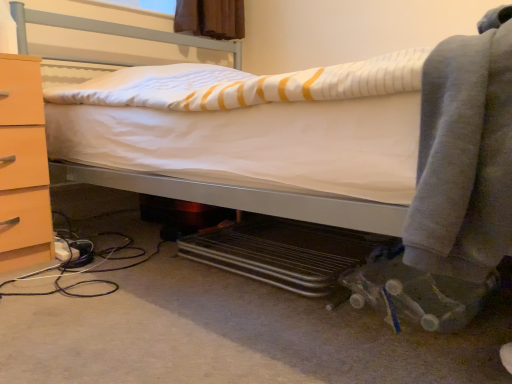
Question: From the image's perspective, does matte wood chest of drawers at left appear lower than gray fleece blanket at lower right?

Choices:
 (A) no
 (B) yes

Answer: (B)

Question: Is matte wood chest of drawers at left not inside gray fleece blanket at lower right?

Choices:
 (A) no
 (B) yes

Answer: (B)

Question: Is matte wood chest of drawers at left closer to camera compared to gray fleece blanket at lower right?

Choices:
 (A) no
 (B) yes

Answer: (A)

Question: From a real-world perspective, is matte wood chest of drawers at left physically above gray fleece blanket at lower right?

Choices:
 (A) no
 (B) yes

Answer: (A)

Question: Can you confirm if matte wood chest of drawers at left is shorter than gray fleece blanket at lower right?

Choices:
 (A) yes
 (B) no

Answer: (B)

Question: Is matte wood chest of drawers at left bigger than gray fleece blanket at lower right?

Choices:
 (A) no
 (B) yes

Answer: (B)

Question: Can you confirm if gray fleece blanket at lower right is positioned to the right of matte wood chest of drawers at left?

Choices:
 (A) yes
 (B) no

Answer: (A)

Question: Considering the relative sizes of gray fleece blanket at lower right and matte wood chest of drawers at left in the image provided, is gray fleece blanket at lower right smaller than matte wood chest of drawers at left?

Choices:
 (A) yes
 (B) no

Answer: (A)

Question: From a real-world perspective, is gray fleece blanket at lower right physically above matte wood chest of drawers at left?

Choices:
 (A) yes
 (B) no

Answer: (A)

Question: Considering the relative sizes of gray fleece blanket at lower right and matte wood chest of drawers at left in the image provided, is gray fleece blanket at lower right wider than matte wood chest of drawers at left?

Choices:
 (A) yes
 (B) no

Answer: (A)

Question: Is gray fleece blanket at lower right to the left of matte wood chest of drawers at left from the viewer's perspective?

Choices:
 (A) no
 (B) yes

Answer: (A)

Question: From the image's perspective, does gray fleece blanket at lower right appear lower than matte wood chest of drawers at left?

Choices:
 (A) no
 (B) yes

Answer: (A)

Question: Is point (505, 137) closer or farther from the camera than point (2, 117)?

Choices:
 (A) farther
 (B) closer

Answer: (B)